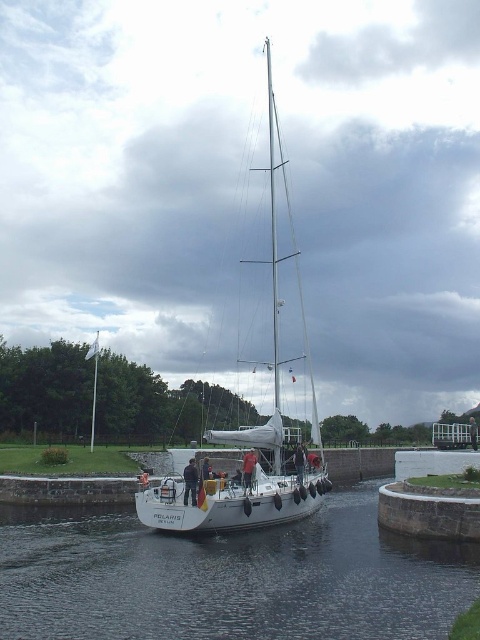
Question: Is white matte sailboat at center positioned behind reddish skin human at center?

Choices:
 (A) no
 (B) yes

Answer: (A)

Question: Which object appears closest to the camera in this image?

Choices:
 (A) reddish skin human at center
 (B) black fabric person at center
 (C) white matte sailboat at center

Answer: (B)

Question: Which of the following is the closest to the observer?

Choices:
 (A) reddish skin human at center
 (B) clear water at center
 (C) black fabric person at center

Answer: (B)

Question: Does black fabric person at center have a smaller size compared to reddish skin human at center?

Choices:
 (A) yes
 (B) no

Answer: (B)

Question: Is clear water at center thinner than reddish skin human at center?

Choices:
 (A) no
 (B) yes

Answer: (A)

Question: Which point is farther to the camera?

Choices:
 (A) brown leather jacket at center
 (B) white matte sailboat at center

Answer: (A)